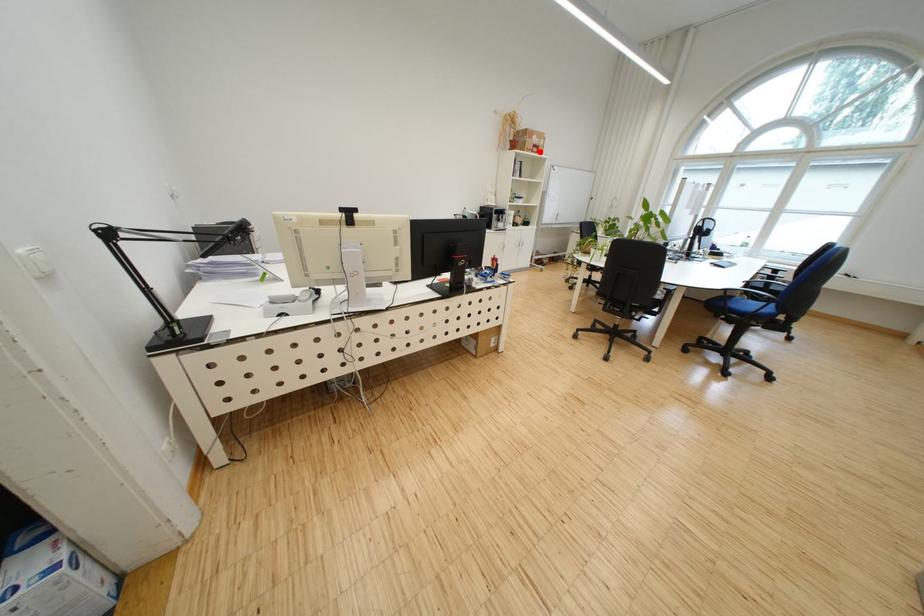
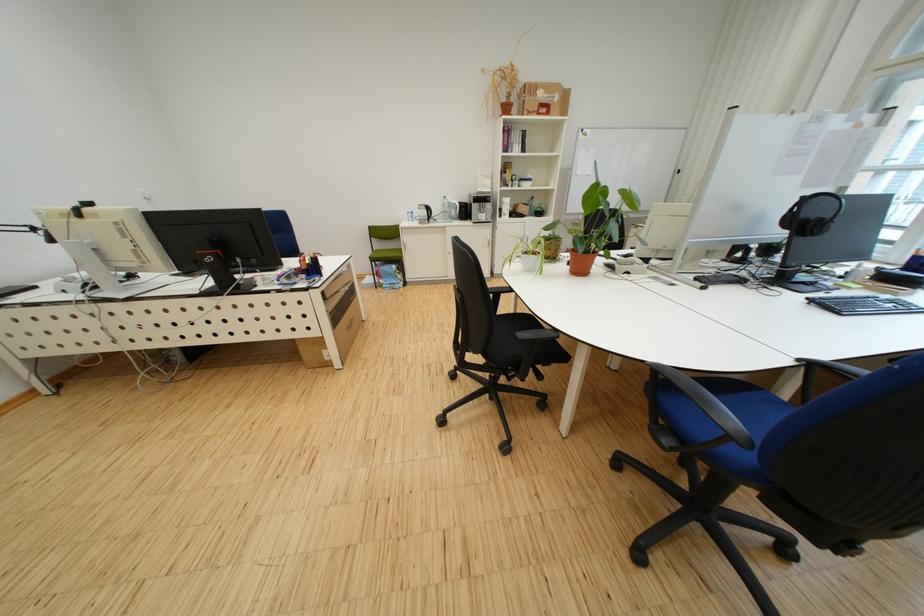
Where in the second image is the point corresponding to the highlighted location from the first image?

(541, 115)